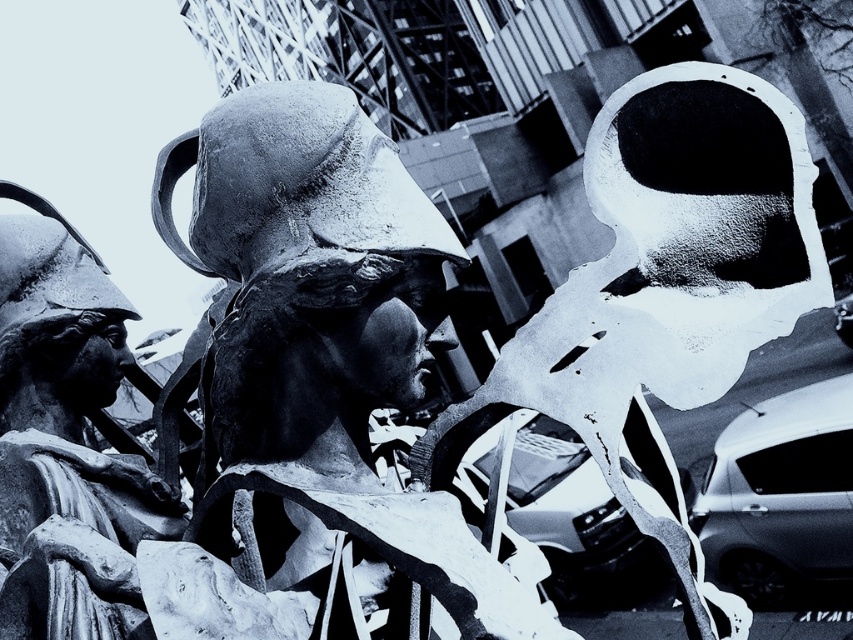
Question: Which of the following is the farthest from the observer?

Choices:
 (A) (643, 525)
 (B) (84, 442)
 (C) (252, 216)

Answer: (B)

Question: From the image, what is the correct spatial relationship of smooth stone statue at center in relation to smooth white mask at center?

Choices:
 (A) left
 (B) right

Answer: (A)

Question: Which point appears farthest from the camera in this image?

Choices:
 (A) (703, 598)
 (B) (45, 412)

Answer: (B)

Question: Can you confirm if smooth stone statue at center is bigger than smooth white mask at center?

Choices:
 (A) no
 (B) yes

Answer: (B)

Question: Based on their relative distances, which object is nearer to the smooth white mask at center?

Choices:
 (A) smooth stone statue at center
 (B) smooth stone statue at left

Answer: (A)

Question: Is smooth stone statue at center bigger than smooth white mask at center?

Choices:
 (A) yes
 (B) no

Answer: (A)